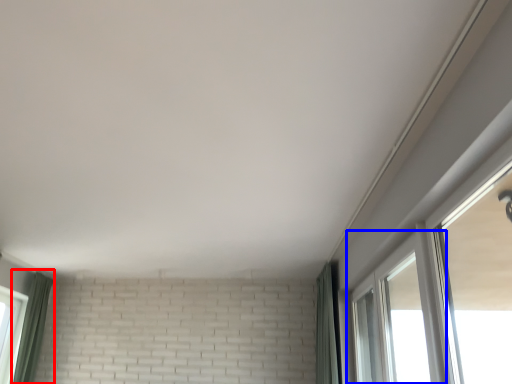
Question: Which object is closer to the camera taking this photo, curtain (highlighted by a red box) or window (highlighted by a blue box)?

Choices:
 (A) curtain
 (B) window

Answer: (B)